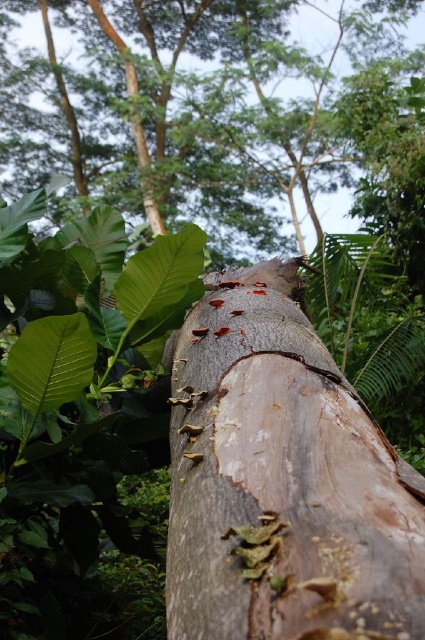
Is the position of smooth brown bark at center more distant than that of rusty wood tree trunk at center?

Yes, smooth brown bark at center is further from the viewer.

Which of these two, smooth brown bark at center or rusty wood tree trunk at center, stands shorter?

With less height is rusty wood tree trunk at center.

In the scene shown: Who is more forward, (217, 58) or (265, 628)?

Point (265, 628)

Locate an element on the screen. Image resolution: width=425 pixels, height=640 pixels. smooth brown bark at center is located at coordinates (189, 109).